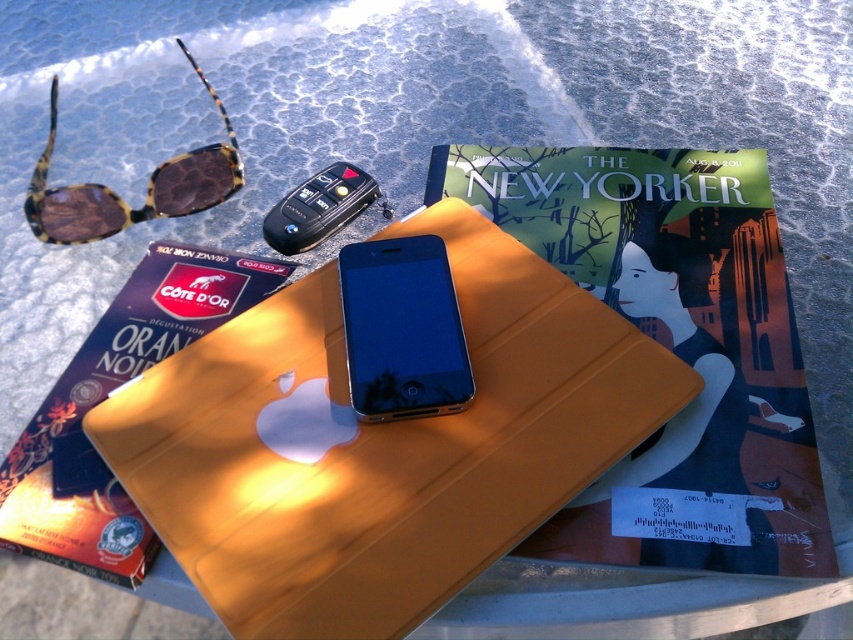
Question: Does matte orange tablet case at center have a lesser width compared to black glossy smartphone at center?

Choices:
 (A) yes
 (B) no

Answer: (B)

Question: Can you confirm if matte orange tablet case at center is wider than black glossy smartphone at center?

Choices:
 (A) yes
 (B) no

Answer: (A)

Question: Does matte paper book at center appear under tortoiseshell acetate sunglasses at upper left?

Choices:
 (A) no
 (B) yes

Answer: (B)

Question: Estimate the real-world distances between objects in this image. Which object is farther from the matte orange tablet case at center?

Choices:
 (A) matte paper book at center
 (B) black glossy smartphone at center
 (C) tortoiseshell acetate sunglasses at upper left

Answer: (A)

Question: Which of the following is the closest to the observer?

Choices:
 (A) (808, 506)
 (B) (393, 332)
 (C) (170, 300)

Answer: (A)

Question: Which of the following is the farthest from the observer?

Choices:
 (A) (172, 157)
 (B) (460, 401)

Answer: (A)